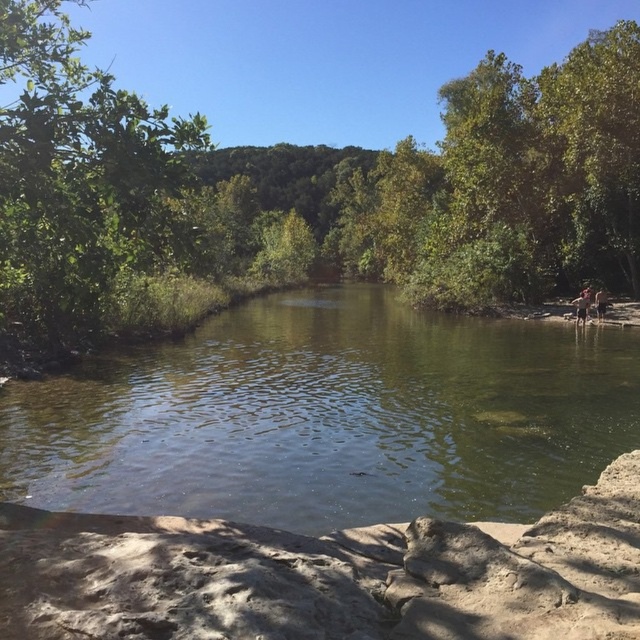
Question: Which is farther from the green leafy tree at upper left?

Choices:
 (A) green leafy tree at center
 (B) green translucent water at center

Answer: (A)

Question: Does green leafy tree at center appear over green translucent water at center?

Choices:
 (A) no
 (B) yes

Answer: (B)

Question: Among these objects, which one is farthest from the camera?

Choices:
 (A) green translucent water at center
 (B) green leafy tree at upper left
 (C) green leafy tree at center

Answer: (A)

Question: Is green translucent water at center above green leafy tree at upper left?

Choices:
 (A) no
 (B) yes

Answer: (A)

Question: Is green leafy tree at center wider than green translucent water at center?

Choices:
 (A) no
 (B) yes

Answer: (B)

Question: Which of the following is the farthest from the observer?

Choices:
 (A) green leafy tree at center
 (B) green leafy tree at upper left
 (C) green translucent water at center

Answer: (C)